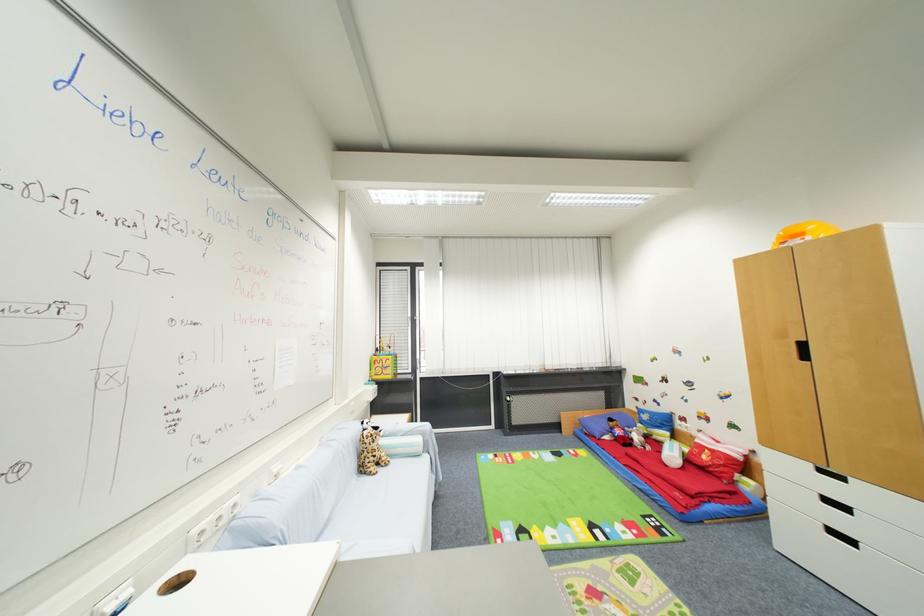
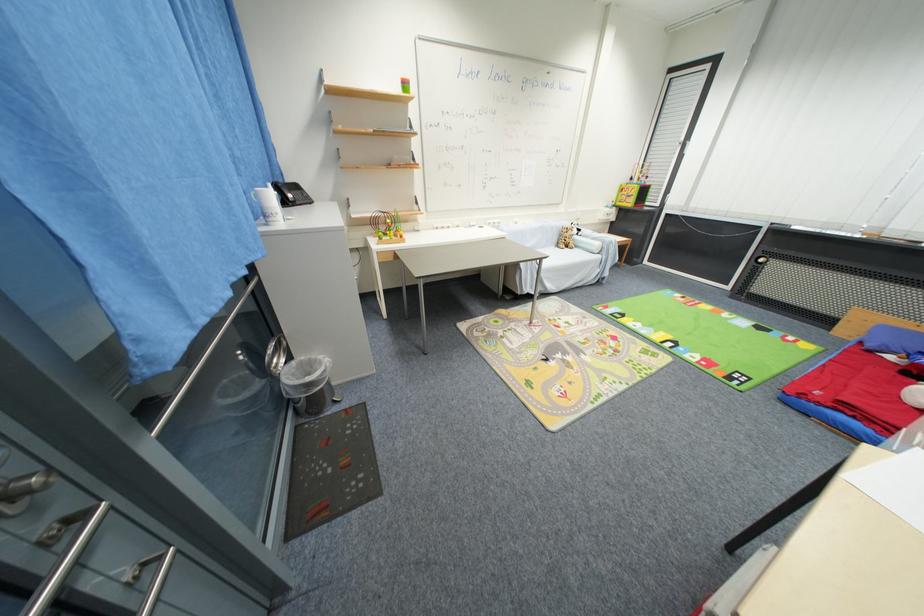
Locate, in the second image, the point that corresponds to (x=431, y=459) in the first image.

(603, 259)